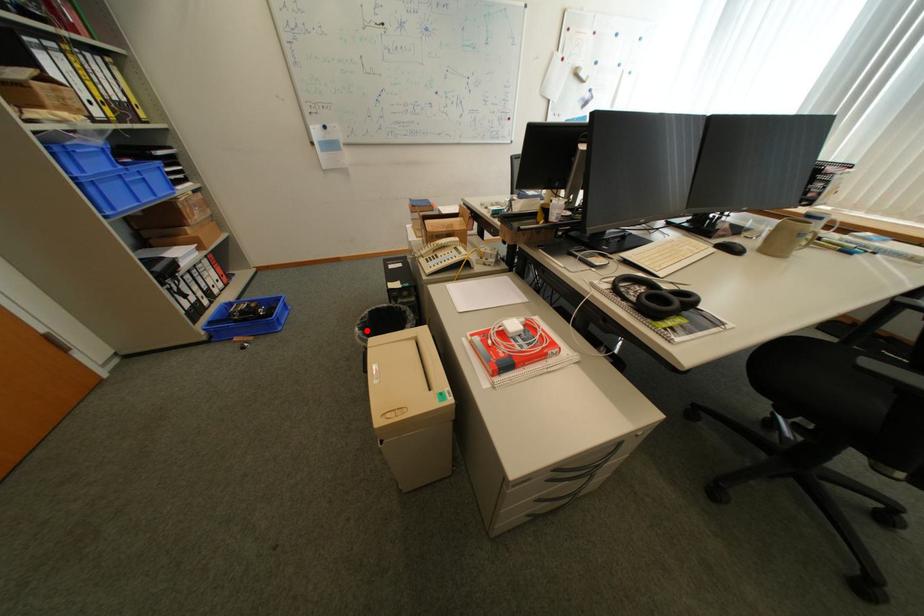
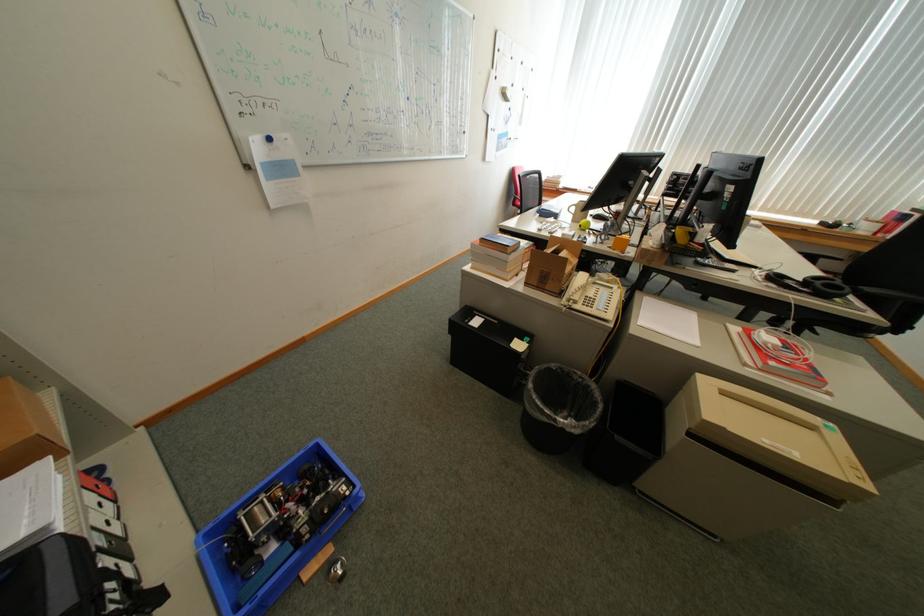
Question: I am providing you with two images of the same scene from different viewpoints. A red point is shown in image1. For the corresponding object point in image2, is it positioned nearer or farther from the camera?

Choices:
 (A) Nearer
 (B) Farther

Answer: (A)